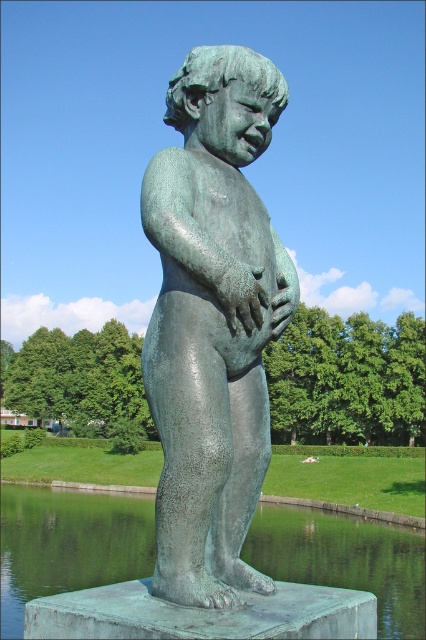
You are standing in front of the bronze statue of a child in the park. You notice two points marked on the statue. One is at coordinate point (230,54) and the other at point (264,509). Which point is closer to your eyes?

The point at coordinate (230,54) is closer to your eyes because it is closer to the camera than point (264,509).